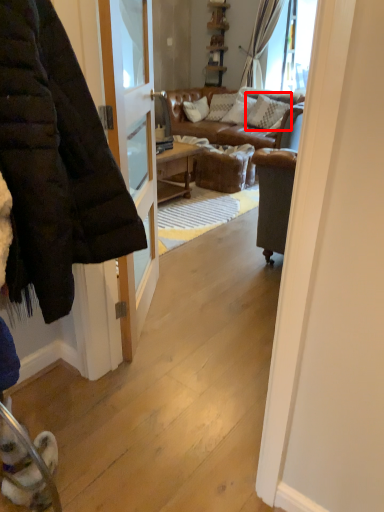
Question: From the image's perspective, where is pillow (annotated by the red box) located in relation to jacket in the image?

Choices:
 (A) above
 (B) below

Answer: (A)